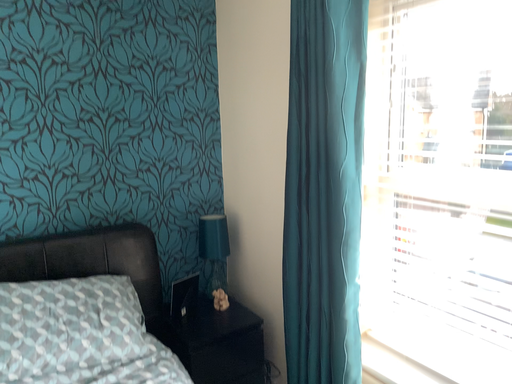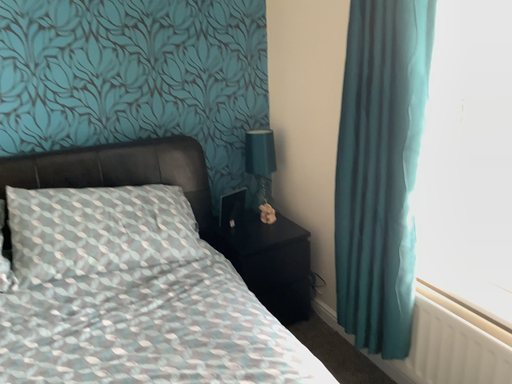
Question: Which way did the camera rotate in the video?

Choices:
 (A) rotated upward
 (B) rotated downward

Answer: (B)